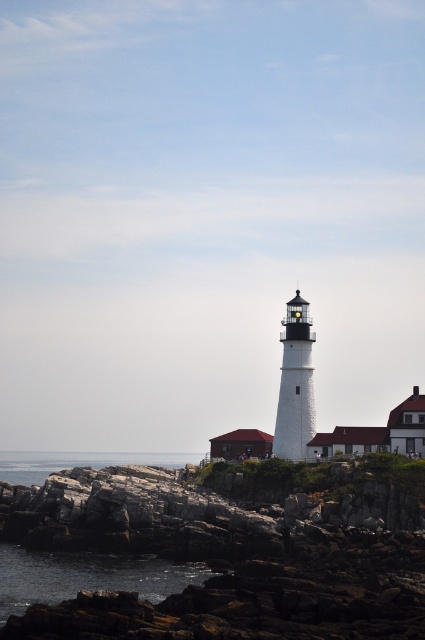
You are a photographer standing at the base of the lighthouse. You want to capture a photo of the lighthouse with both the dark water at lower left and clear water at lower left visible in the frame. Which water area should you position closer to the front of the photo to include both?

You should position the dark water at lower left closer to the front of the photo since it is in front of the clear water at lower left, allowing both to be visible in the frame.